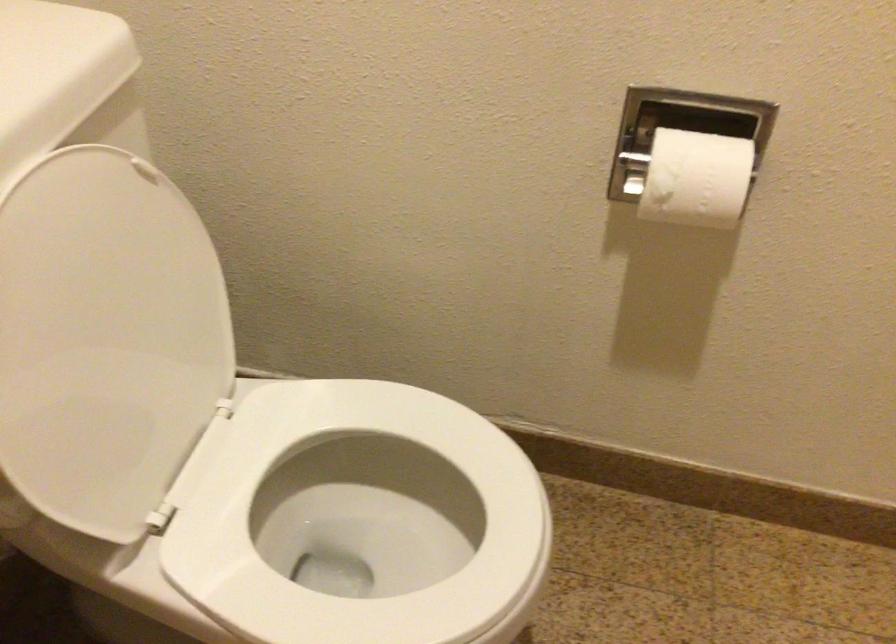
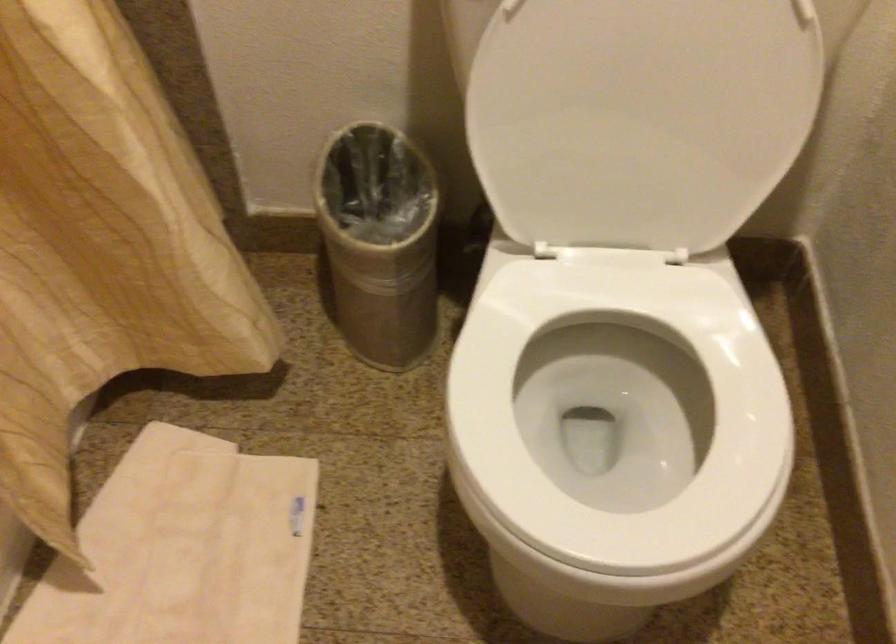
Where in the second image is the point corresponding to (x=130, y=345) from the first image?

(640, 118)